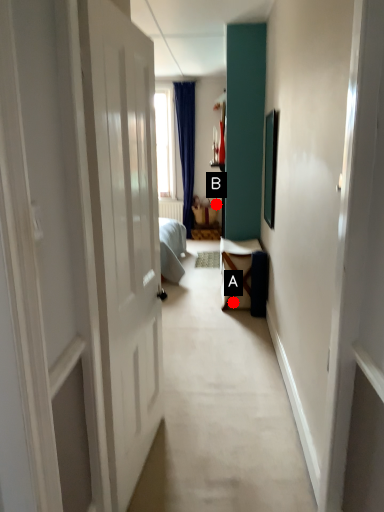
Question: Two points are circled on the image, labeled by A and B beside each circle. Which point is closer to the camera?

Choices:
 (A) A is closer
 (B) B is closer

Answer: (A)